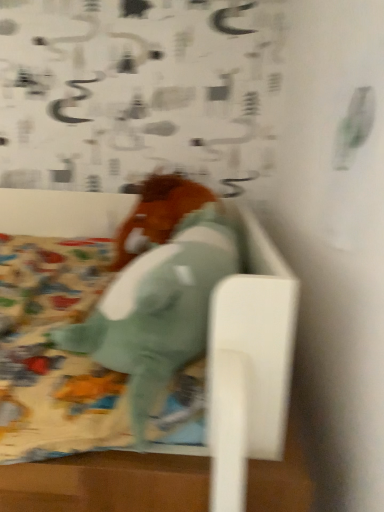
Image resolution: width=384 pixels, height=512 pixels. What are the coordinates of `brown matte horse at center, the 2th animal positioned from the front` in the screenshot? It's located at (158, 215).

This screenshot has width=384, height=512. What do you see at coordinates (158, 215) in the screenshot? I see `brown matte horse at center, the 2th animal positioned from the front` at bounding box center [158, 215].

Find the location of a particular element. soft teal plush horse at center, the second animal from the back is located at coordinates (158, 311).

Measure the distance between soft teal plush horse at center, the second animal from the back, and camera.

soft teal plush horse at center, the second animal from the back, and camera are 19.90 inches apart from each other.

Describe the element at coordinates (158, 311) in the screenshot. I see `soft teal plush horse at center, which ranks as the 1th animal in front-to-back order` at that location.

The height and width of the screenshot is (512, 384). Identify the location of brown matte horse at center, the first animal when ordered from back to front. point(158,215).

Considering the relative positions of soft teal plush horse at center, the second animal from the back, and brown matte horse at center, the first animal when ordered from back to front, in the image provided, is soft teal plush horse at center, the second animal from the back, to the left or to the right of brown matte horse at center, the first animal when ordered from back to front,?

From the image, it's evident that soft teal plush horse at center, the second animal from the back, is to the right of brown matte horse at center, the first animal when ordered from back to front.

Considering the positions of objects soft teal plush horse at center, which ranks as the 1th animal in front-to-back order, and brown matte horse at center, the 2th animal positioned from the front, in the image provided, who is behind, soft teal plush horse at center, which ranks as the 1th animal in front-to-back order, or brown matte horse at center, the 2th animal positioned from the front,?

brown matte horse at center, the 2th animal positioned from the front, is further from the camera.

Considering the positions of points (128, 340) and (143, 238), is point (128, 340) closer to camera compared to point (143, 238)?

Yes, point (128, 340) is closer to viewer.

Based on the photo, from the image's perspective, who appears lower, soft teal plush horse at center, the second animal from the back, or brown matte horse at center, the first animal when ordered from back to front?

soft teal plush horse at center, the second animal from the back, from the image's perspective.

From a real-world perspective, which is physically below, soft teal plush horse at center, which ranks as the 1th animal in front-to-back order, or brown matte horse at center, the first animal when ordered from back to front?

soft teal plush horse at center, which ranks as the 1th animal in front-to-back order, from a real-world perspective.

Which of these two, soft teal plush horse at center, which ranks as the 1th animal in front-to-back order, or brown matte horse at center, the 2th animal positioned from the front, is wider?

With larger width is brown matte horse at center, the 2th animal positioned from the front.

Does soft teal plush horse at center, which ranks as the 1th animal in front-to-back order, have a lesser height compared to brown matte horse at center, the first animal when ordered from back to front?

Yes.

Does soft teal plush horse at center, which ranks as the 1th animal in front-to-back order, have a smaller size compared to brown matte horse at center, the 2th animal positioned from the front?

No, soft teal plush horse at center, which ranks as the 1th animal in front-to-back order, is not smaller than brown matte horse at center, the 2th animal positioned from the front.

Can brown matte horse at center, the 2th animal positioned from the front, be found inside soft teal plush horse at center, which ranks as the 1th animal in front-to-back order?

No, brown matte horse at center, the 2th animal positioned from the front, is not inside soft teal plush horse at center, which ranks as the 1th animal in front-to-back order.

Does soft teal plush horse at center, which ranks as the 1th animal in front-to-back order, touch brown matte horse at center, the 2th animal positioned from the front?

They are not placed beside each other.

Does soft teal plush horse at center, which ranks as the 1th animal in front-to-back order, turn towards brown matte horse at center, the first animal when ordered from back to front?

No, soft teal plush horse at center, which ranks as the 1th animal in front-to-back order, is not facing towards brown matte horse at center, the first animal when ordered from back to front.

What's the angular difference between soft teal plush horse at center, which ranks as the 1th animal in front-to-back order, and brown matte horse at center, the first animal when ordered from back to front,'s facing directions?

The angular difference between soft teal plush horse at center, which ranks as the 1th animal in front-to-back order, and brown matte horse at center, the first animal when ordered from back to front, is 94.6 degrees.

Where is `animal below the brown matte horse at center, the first animal when ordered from back to front (from a real-world perspective)`? animal below the brown matte horse at center, the first animal when ordered from back to front (from a real-world perspective) is located at coordinates (158, 311).

Consider the image. Which object is positioned more to the left, brown matte horse at center, the 2th animal positioned from the front, or soft teal plush horse at center, the second animal from the back?

brown matte horse at center, the 2th animal positioned from the front.

Is brown matte horse at center, the first animal when ordered from back to front, further to the viewer compared to soft teal plush horse at center, the second animal from the back?

Yes, it is behind soft teal plush horse at center, the second animal from the back.

Is point (158, 220) less distant than point (120, 353)?

No.

From the image's perspective, between brown matte horse at center, the first animal when ordered from back to front, and soft teal plush horse at center, the second animal from the back, which one is located above?

brown matte horse at center, the first animal when ordered from back to front.

From the picture: From a real-world perspective, is brown matte horse at center, the 2th animal positioned from the front, positioned above or below soft teal plush horse at center, which ranks as the 1th animal in front-to-back order?

In terms of real-world spatial position, brown matte horse at center, the 2th animal positioned from the front, is above soft teal plush horse at center, which ranks as the 1th animal in front-to-back order.

In terms of width, does brown matte horse at center, the 2th animal positioned from the front, look wider or thinner when compared to soft teal plush horse at center, the second animal from the back?

brown matte horse at center, the 2th animal positioned from the front, is wider than soft teal plush horse at center, the second animal from the back.

Who is shorter, brown matte horse at center, the first animal when ordered from back to front, or soft teal plush horse at center, which ranks as the 1th animal in front-to-back order?

soft teal plush horse at center, which ranks as the 1th animal in front-to-back order.

Who is bigger, brown matte horse at center, the first animal when ordered from back to front, or soft teal plush horse at center, the second animal from the back?

With larger size is soft teal plush horse at center, the second animal from the back.

Is brown matte horse at center, the first animal when ordered from back to front, spatially inside soft teal plush horse at center, which ranks as the 1th animal in front-to-back order, or outside of it?

brown matte horse at center, the first animal when ordered from back to front, lies outside soft teal plush horse at center, which ranks as the 1th animal in front-to-back order.

Is brown matte horse at center, the 2th animal positioned from the front, not close to soft teal plush horse at center, the second animal from the back?

brown matte horse at center, the 2th animal positioned from the front, is actually quite close to soft teal plush horse at center, the second animal from the back.

Is brown matte horse at center, the first animal when ordered from back to front, facing towards soft teal plush horse at center, which ranks as the 1th animal in front-to-back order?

Yes, brown matte horse at center, the first animal when ordered from back to front, is oriented towards soft teal plush horse at center, which ranks as the 1th animal in front-to-back order.

What's the angular difference between brown matte horse at center, the first animal when ordered from back to front, and soft teal plush horse at center, the second animal from the back,'s facing directions?

brown matte horse at center, the first animal when ordered from back to front, and soft teal plush horse at center, the second animal from the back, are facing 94.6 degrees away from each other.

At what (x,y) coordinates should I click in order to perform the action: click on animal to the left of soft teal plush horse at center, which ranks as the 1th animal in front-to-back order. Please return your answer as a coordinate pair (x, y). The height and width of the screenshot is (512, 384). Looking at the image, I should click on (x=158, y=215).

Locate an element on the screen. animal behind the soft teal plush horse at center, the second animal from the back is located at coordinates (158, 215).

This screenshot has height=512, width=384. I want to click on animal that appears in front of the brown matte horse at center, the 2th animal positioned from the front, so click(158, 311).